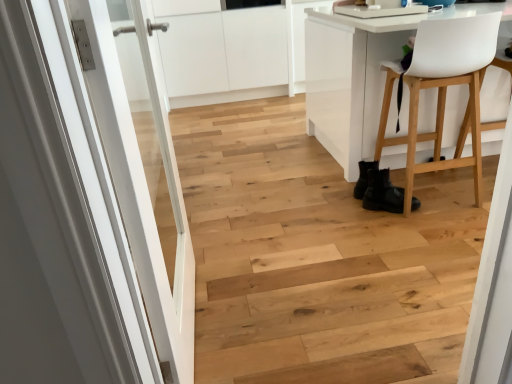
Question: Considering the relative positions of white glossy door at left and black leather boots at lower right in the image provided, is white glossy door at left to the right of black leather boots at lower right from the viewer's perspective?

Choices:
 (A) no
 (B) yes

Answer: (A)

Question: Is white glossy door at left facing towards black leather boots at lower right?

Choices:
 (A) yes
 (B) no

Answer: (A)

Question: Are white glossy door at left and black leather boots at lower right located far from each other?

Choices:
 (A) no
 (B) yes

Answer: (B)

Question: From a real-world perspective, does white glossy door at left sit lower than black leather boots at lower right?

Choices:
 (A) no
 (B) yes

Answer: (A)

Question: Is white glossy door at left closer to the viewer compared to black leather boots at lower right?

Choices:
 (A) yes
 (B) no

Answer: (A)

Question: Does white glossy door at left have a larger size compared to black leather boots at lower right?

Choices:
 (A) yes
 (B) no

Answer: (A)

Question: Can you confirm if white plastic chair at right is smaller than black leather boots at lower right?

Choices:
 (A) no
 (B) yes

Answer: (A)

Question: Does white plastic chair at right have a lesser height compared to black leather boots at lower right?

Choices:
 (A) no
 (B) yes

Answer: (A)

Question: Is white plastic chair at right taller than black leather boots at lower right?

Choices:
 (A) yes
 (B) no

Answer: (A)

Question: Can you confirm if white plastic chair at right is positioned to the left of black leather boots at lower right?

Choices:
 (A) no
 (B) yes

Answer: (A)

Question: Considering the relative sizes of white plastic chair at right and black leather boots at lower right in the image provided, is white plastic chair at right wider than black leather boots at lower right?

Choices:
 (A) yes
 (B) no

Answer: (A)

Question: From the image's perspective, is white plastic chair at right located beneath black leather boots at lower right?

Choices:
 (A) yes
 (B) no

Answer: (B)

Question: From a real-world perspective, is white glossy door at left under white plastic chair at right?

Choices:
 (A) no
 (B) yes

Answer: (A)